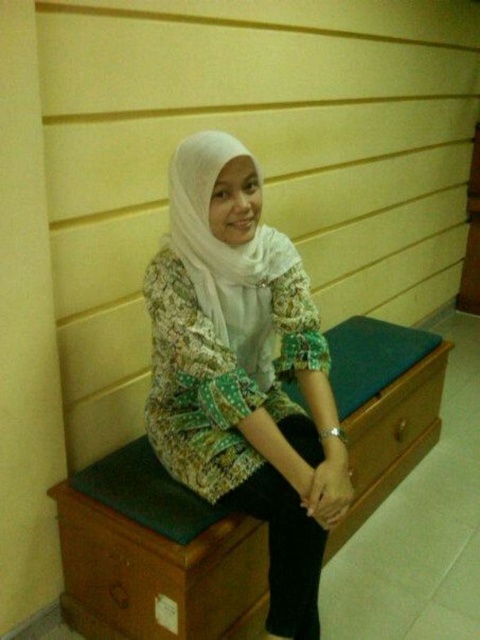
Who is more distant from viewer, (180, 244) or (396, 417)?

The point (396, 417) is more distant.

Which is in front, point (259, 285) or point (434, 387)?

Positioned in front is point (259, 285).

Is point (254, 237) positioned behind point (417, 426)?

No.

I want to click on white sheer headscarf at center, so click(227, 256).

Can you confirm if batik fabric hijab at center is wider than white sheer headscarf at center?

Yes.

Is point (166, 320) farther from camera compared to point (269, 240)?

No, (166, 320) is in front of (269, 240).

Between point (315, 330) and point (229, 324), which one is positioned behind?

Positioned behind is point (315, 330).

Find the location of `batik fabric hijab at center`. batik fabric hijab at center is located at coordinates (243, 372).

Can you confirm if batik fabric hijab at center is positioned to the right of green fabric drawer at center?

Incorrect, batik fabric hijab at center is not on the right side of green fabric drawer at center.

Who is more distant from viewer, (303, 512) or (346, 429)?

Positioned behind is point (346, 429).

Where is `batik fabric hijab at center`? The width and height of the screenshot is (480, 640). batik fabric hijab at center is located at coordinates (243, 372).